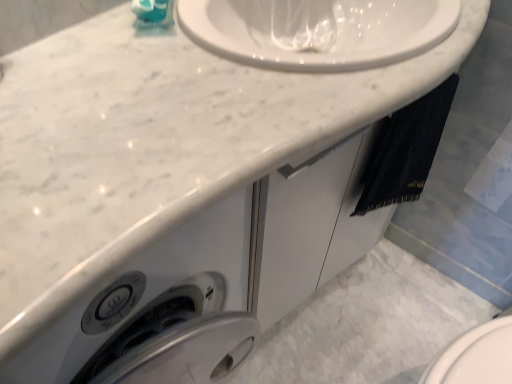
Describe the element at coordinates (153, 13) in the screenshot. This screenshot has width=512, height=384. I see `teal glossy soap dispenser at upper left` at that location.

Locate an element on the screen. teal glossy soap dispenser at upper left is located at coordinates (153, 13).

Where is `black denim towel at right`? Image resolution: width=512 pixels, height=384 pixels. black denim towel at right is located at coordinates (408, 150).

Describe the element at coordinates (408, 150) in the screenshot. The width and height of the screenshot is (512, 384). I see `black denim towel at right` at that location.

Locate an element on the screen. teal glossy soap dispenser at upper left is located at coordinates (153, 13).

Can you confirm if teal glossy soap dispenser at upper left is positioned to the right of black denim towel at right?

No, teal glossy soap dispenser at upper left is not to the right of black denim towel at right.

Considering their positions, is teal glossy soap dispenser at upper left located in front of or behind black denim towel at right?

teal glossy soap dispenser at upper left is in front of black denim towel at right.

Is point (150, 27) in front of point (366, 208)?

That is True.

From the image's perspective, between teal glossy soap dispenser at upper left and black denim towel at right, which one is located above?

From the image's view, teal glossy soap dispenser at upper left is above.

From a real-world perspective, between teal glossy soap dispenser at upper left and black denim towel at right, who is vertically lower?

black denim towel at right, from a real-world perspective.

Considering the sizes of objects teal glossy soap dispenser at upper left and black denim towel at right in the image provided, who is thinner, teal glossy soap dispenser at upper left or black denim towel at right?

black denim towel at right.

Is teal glossy soap dispenser at upper left shorter than black denim towel at right?

Yes.

Based on the photo, based on their sizes in the image, would you say teal glossy soap dispenser at upper left is bigger or smaller than black denim towel at right?

Considering their sizes, teal glossy soap dispenser at upper left takes up less space than black denim towel at right.

Is black denim towel at right surrounded by teal glossy soap dispenser at upper left?

That's incorrect, black denim towel at right is not inside teal glossy soap dispenser at upper left.

Can you see teal glossy soap dispenser at upper left touching black denim towel at right?

teal glossy soap dispenser at upper left and black denim towel at right are not in contact.

Is teal glossy soap dispenser at upper left positioned with its back to black denim towel at right?

That's not correct — teal glossy soap dispenser at upper left is not looking away from black denim towel at right.

What's the angular difference between teal glossy soap dispenser at upper left and black denim towel at right's facing directions?

The facing directions of teal glossy soap dispenser at upper left and black denim towel at right are 17.9 degrees apart.

How far apart are teal glossy soap dispenser at upper left and black denim towel at right?

They are 56.68 centimeters apart.

What are the coordinates of `soap dispenser above the black denim towel at right (from a real-world perspective)` in the screenshot? It's located at (153, 13).

Considering the positions of objects black denim towel at right and teal glossy soap dispenser at upper left in the image provided, who is more to the left, black denim towel at right or teal glossy soap dispenser at upper left?

From the viewer's perspective, teal glossy soap dispenser at upper left appears more on the left side.

Looking at this image, is black denim towel at right in front of or behind teal glossy soap dispenser at upper left in the image?

black denim towel at right is positioned farther from the viewer than teal glossy soap dispenser at upper left.

Is point (399, 185) less distant than point (165, 1)?

No, (399, 185) is further to viewer.

From the image's perspective, is black denim towel at right on teal glossy soap dispenser at upper left?

Actually, black denim towel at right appears below teal glossy soap dispenser at upper left in the image.

From a real-world perspective, is black denim towel at right located beneath teal glossy soap dispenser at upper left?

Yes, from a real-world perspective, black denim towel at right is below teal glossy soap dispenser at upper left.

Can you confirm if black denim towel at right is wider than teal glossy soap dispenser at upper left?

Incorrect, the width of black denim towel at right does not surpass that of teal glossy soap dispenser at upper left.

Is black denim towel at right taller or shorter than teal glossy soap dispenser at upper left?

Considering their sizes, black denim towel at right has more height than teal glossy soap dispenser at upper left.

Considering the sizes of objects black denim towel at right and teal glossy soap dispenser at upper left in the image provided, who is smaller, black denim towel at right or teal glossy soap dispenser at upper left?

teal glossy soap dispenser at upper left is smaller.

Is black denim towel at right inside the boundaries of teal glossy soap dispenser at upper left, or outside?

black denim towel at right lies outside teal glossy soap dispenser at upper left.

Is black denim towel at right with teal glossy soap dispenser at upper left?

No.

Is black denim towel at right facing towards teal glossy soap dispenser at upper left?

No, black denim towel at right is not turned towards teal glossy soap dispenser at upper left.

The image size is (512, 384). In order to click on bath towel that is behind the teal glossy soap dispenser at upper left in this screenshot , I will do `click(408, 150)`.

This screenshot has width=512, height=384. Find the location of `bath towel that is below the teal glossy soap dispenser at upper left (from the image's perspective)`. bath towel that is below the teal glossy soap dispenser at upper left (from the image's perspective) is located at coordinates (408, 150).

Image resolution: width=512 pixels, height=384 pixels. What are the coordinates of `soap dispenser above the black denim towel at right (from the image's perspective)` in the screenshot? It's located at (153, 13).